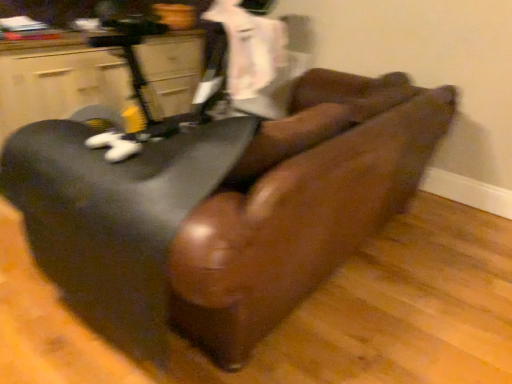
Describe the element at coordinates (214, 217) in the screenshot. I see `leather couch at center, which ranks as the 2th furniture in left-to-right order` at that location.

Image resolution: width=512 pixels, height=384 pixels. In order to click on leather couch at center, the first furniture positioned from the right in this screenshot , I will do `click(214, 217)`.

This screenshot has height=384, width=512. Describe the element at coordinates (59, 85) in the screenshot. I see `matte black chair at left, the 2th furniture positioned from the right` at that location.

The width and height of the screenshot is (512, 384). In order to click on matte black chair at left, the 2th furniture positioned from the right in this screenshot , I will do `click(59, 85)`.

The image size is (512, 384). Find the location of `leather couch at center, which ranks as the 2th furniture in left-to-right order`. leather couch at center, which ranks as the 2th furniture in left-to-right order is located at coordinates 214,217.

Considering the relative positions of leather couch at center, which ranks as the 2th furniture in left-to-right order, and matte black chair at left, which is counted as the 1th furniture, starting from the left, in the image provided, is leather couch at center, which ranks as the 2th furniture in left-to-right order, to the left or to the right of matte black chair at left, which is counted as the 1th furniture, starting from the left,?

leather couch at center, which ranks as the 2th furniture in left-to-right order, is to the right of matte black chair at left, which is counted as the 1th furniture, starting from the left.

Is the depth of leather couch at center, which ranks as the 2th furniture in left-to-right order, less than that of matte black chair at left, the 2th furniture positioned from the right?

That is True.

Considering the positions of point (138, 194) and point (16, 71), is point (138, 194) closer or farther from the camera than point (16, 71)?

Point (138, 194).

From the image's perspective, between leather couch at center, which ranks as the 2th furniture in left-to-right order, and matte black chair at left, which is counted as the 1th furniture, starting from the left, who is located below?

leather couch at center, which ranks as the 2th furniture in left-to-right order, from the image's perspective.

From a real-world perspective, does leather couch at center, the first furniture positioned from the right, sit lower than matte black chair at left, which is counted as the 1th furniture, starting from the left?

Yes, from a real-world perspective, leather couch at center, the first furniture positioned from the right, is under matte black chair at left, which is counted as the 1th furniture, starting from the left.

Can you confirm if leather couch at center, the first furniture positioned from the right, is thinner than matte black chair at left, the 2th furniture positioned from the right?

Incorrect, the width of leather couch at center, the first furniture positioned from the right, is not less than that of matte black chair at left, the 2th furniture positioned from the right.

Between leather couch at center, which ranks as the 2th furniture in left-to-right order, and matte black chair at left, the 2th furniture positioned from the right, which one has more height?

Standing taller between the two is leather couch at center, which ranks as the 2th furniture in left-to-right order.

Between leather couch at center, which ranks as the 2th furniture in left-to-right order, and matte black chair at left, the 2th furniture positioned from the right, which one has smaller size?

matte black chair at left, the 2th furniture positioned from the right.

Is leather couch at center, which ranks as the 2th furniture in left-to-right order, not within matte black chair at left, which is counted as the 1th furniture, starting from the left?

leather couch at center, which ranks as the 2th furniture in left-to-right order, lies outside matte black chair at left, which is counted as the 1th furniture, starting from the left,'s area.

Based on the photo, is there a large distance between leather couch at center, which ranks as the 2th furniture in left-to-right order, and matte black chair at left, which is counted as the 1th furniture, starting from the left?

Yes.

Is leather couch at center, which ranks as the 2th furniture in left-to-right order, facing away from matte black chair at left, which is counted as the 1th furniture, starting from the left?

Correct, leather couch at center, which ranks as the 2th furniture in left-to-right order, is looking away from matte black chair at left, which is counted as the 1th furniture, starting from the left.

How far apart are leather couch at center, which ranks as the 2th furniture in left-to-right order, and matte black chair at left, which is counted as the 1th furniture, starting from the left?

They are 3.72 feet apart.

You are a GUI agent. You are given a task and a screenshot of the screen. Output one action in this format:
    pyautogui.click(x=<x>, y=<y>)
    Task: Click on the furniture to the left of leather couch at center, which ranks as the 2th furniture in left-to-right order
    
    Given the screenshot: What is the action you would take?
    pyautogui.click(x=59, y=85)

Can you confirm if matte black chair at left, the 2th furniture positioned from the right, is positioned to the right of leather couch at center, the first furniture positioned from the right?

In fact, matte black chair at left, the 2th furniture positioned from the right, is to the left of leather couch at center, the first furniture positioned from the right.

Relative to leather couch at center, which ranks as the 2th furniture in left-to-right order, is matte black chair at left, which is counted as the 1th furniture, starting from the left, in front or behind?

matte black chair at left, which is counted as the 1th furniture, starting from the left, is behind leather couch at center, which ranks as the 2th furniture in left-to-right order.

Does point (161, 46) lie in front of point (196, 156)?

No.

From the image's perspective, is matte black chair at left, which is counted as the 1th furniture, starting from the left, above or below leather couch at center, which ranks as the 2th furniture in left-to-right order?

From the image's perspective, matte black chair at left, which is counted as the 1th furniture, starting from the left, appears above leather couch at center, which ranks as the 2th furniture in left-to-right order.

From a real-world perspective, relative to leather couch at center, the first furniture positioned from the right, is matte black chair at left, which is counted as the 1th furniture, starting from the left, vertically above or below?

Clearly, from a real-world perspective, matte black chair at left, which is counted as the 1th furniture, starting from the left, is above leather couch at center, the first furniture positioned from the right.

Considering the sizes of objects matte black chair at left, which is counted as the 1th furniture, starting from the left, and leather couch at center, the first furniture positioned from the right, in the image provided, who is wider, matte black chair at left, which is counted as the 1th furniture, starting from the left, or leather couch at center, the first furniture positioned from the right,?

leather couch at center, the first furniture positioned from the right.

Considering the relative sizes of matte black chair at left, which is counted as the 1th furniture, starting from the left, and leather couch at center, the first furniture positioned from the right, in the image provided, is matte black chair at left, which is counted as the 1th furniture, starting from the left, shorter than leather couch at center, the first furniture positioned from the right,?

Yes, matte black chair at left, which is counted as the 1th furniture, starting from the left, is shorter than leather couch at center, the first furniture positioned from the right.

Considering the sizes of objects matte black chair at left, the 2th furniture positioned from the right, and leather couch at center, which ranks as the 2th furniture in left-to-right order, in the image provided, who is bigger, matte black chair at left, the 2th furniture positioned from the right, or leather couch at center, which ranks as the 2th furniture in left-to-right order,?

Bigger between the two is leather couch at center, which ranks as the 2th furniture in left-to-right order.

Can leather couch at center, the first furniture positioned from the right, be found inside matte black chair at left, which is counted as the 1th furniture, starting from the left?

Answer: No, leather couch at center, the first furniture positioned from the right, is not a part of matte black chair at left, which is counted as the 1th furniture, starting from the left.

Is matte black chair at left, which is counted as the 1th furniture, starting from the left, far from leather couch at center, the first furniture positioned from the right?

matte black chair at left, which is counted as the 1th furniture, starting from the left, is far away from leather couch at center, the first furniture positioned from the right.

Is matte black chair at left, which is counted as the 1th furniture, starting from the left, oriented away from leather couch at center, the first furniture positioned from the right?

No, matte black chair at left, which is counted as the 1th furniture, starting from the left, is not facing the opposite direction of leather couch at center, the first furniture positioned from the right.

Measure the distance between matte black chair at left, the 2th furniture positioned from the right, and leather couch at center, the first furniture positioned from the right.

matte black chair at left, the 2th furniture positioned from the right, is 3.72 feet away from leather couch at center, the first furniture positioned from the right.

I want to click on furniture on the right of matte black chair at left, the 2th furniture positioned from the right, so tap(214, 217).

Find the location of `furniture located behind the leather couch at center, the first furniture positioned from the right`. furniture located behind the leather couch at center, the first furniture positioned from the right is located at coordinates (59, 85).

Image resolution: width=512 pixels, height=384 pixels. Identify the location of furniture above the leather couch at center, the first furniture positioned from the right (from the image's perspective). [59, 85].